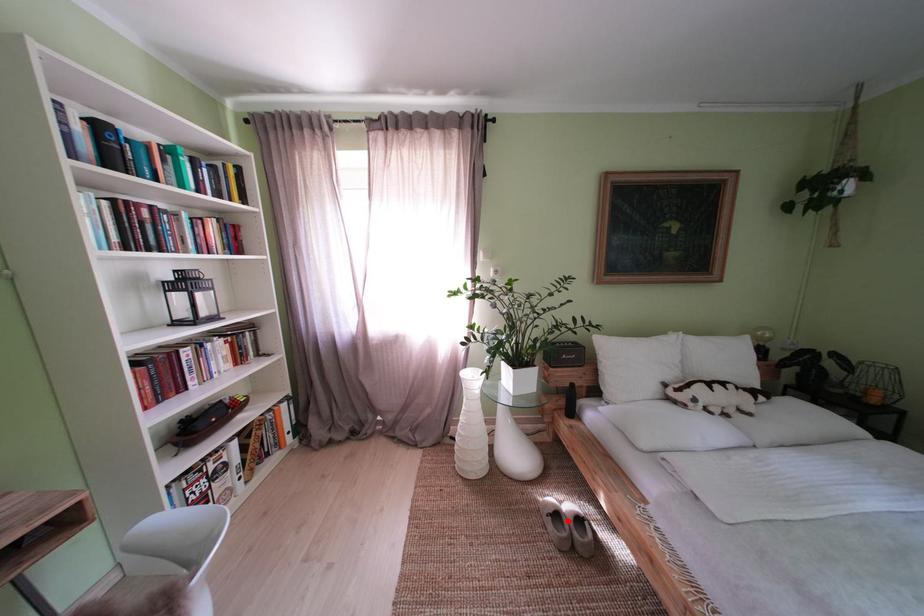
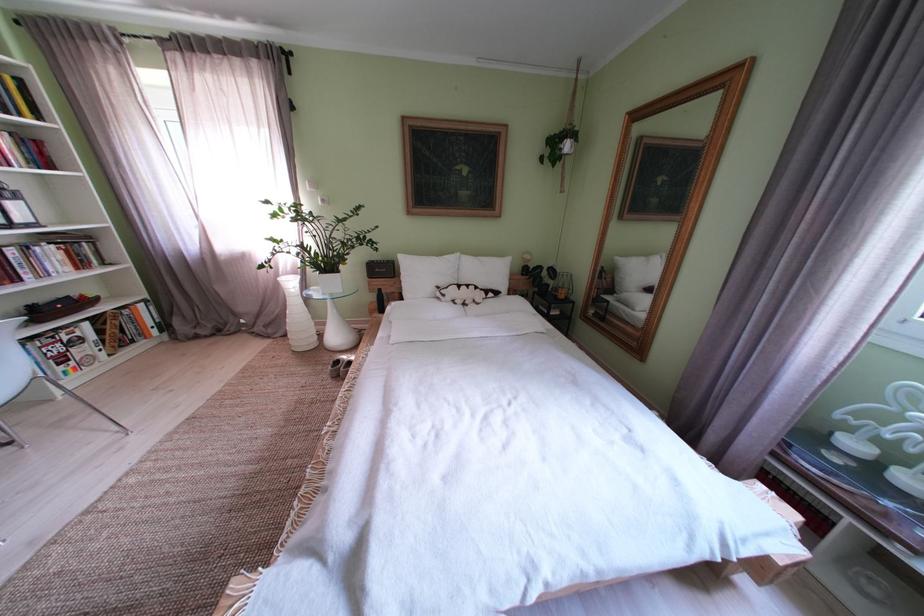
Question: I am providing you with two images of the same scene from different viewpoints. A red point is shown in image1. For the corresponding object point in image2, is it positioned nearer or farther from the camera?

Choices:
 (A) Nearer
 (B) Farther

Answer: (B)